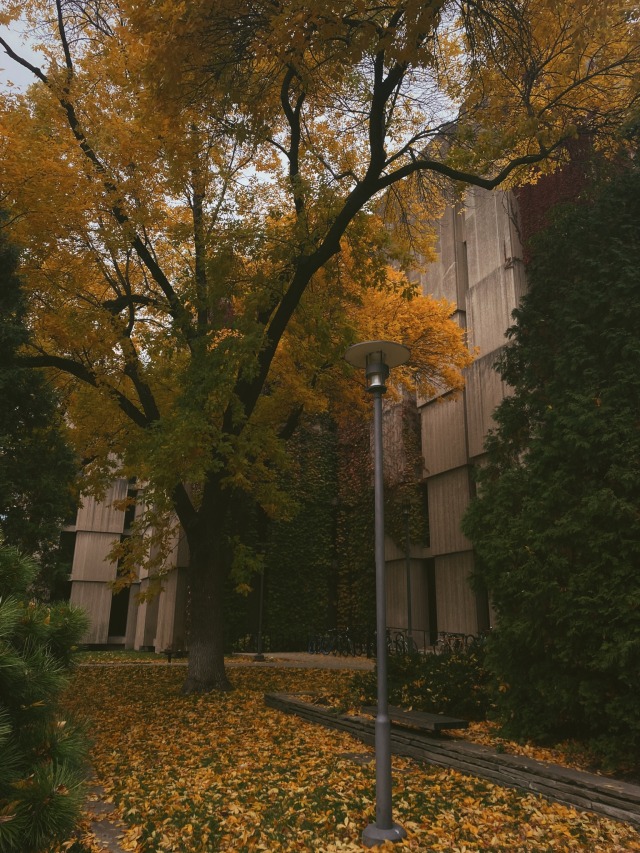
The height and width of the screenshot is (853, 640). In order to click on lamp shade in this screenshot , I will do `click(390, 347)`.